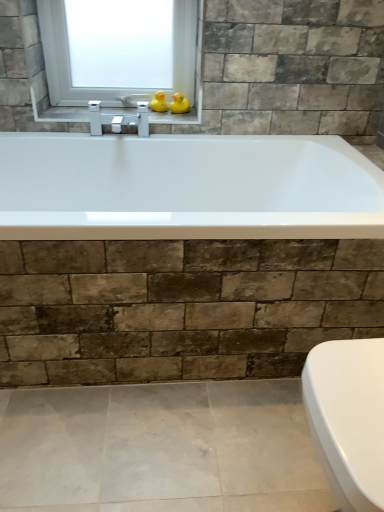
This screenshot has height=512, width=384. In order to click on vacant area that is in front of rubber duck at upper center, the first duck in the left-to-right sequence in this screenshot , I will do `click(154, 119)`.